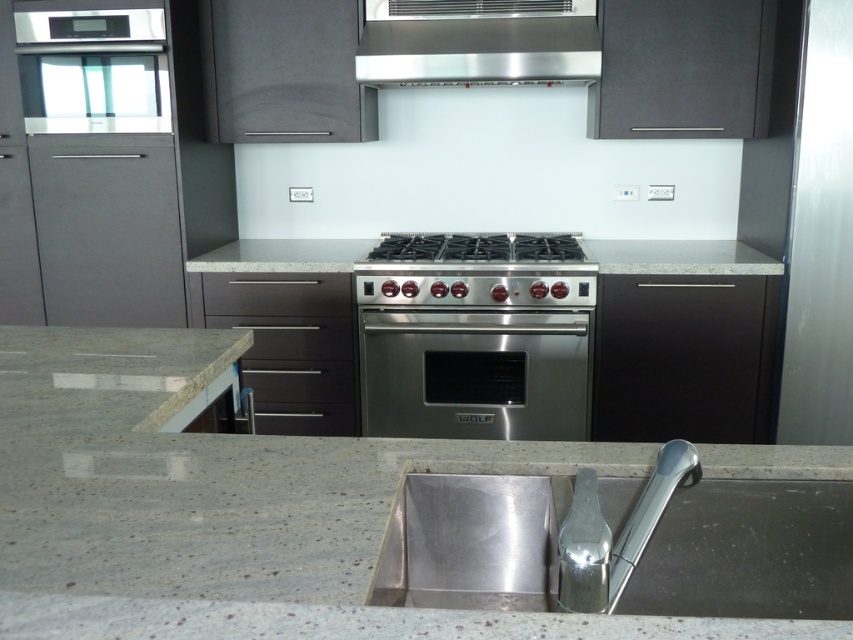
Question: Which of the following is the farthest from the observer?

Choices:
 (A) (405, 394)
 (B) (540, 588)
 (C) (21, 563)
 (D) (645, 492)

Answer: (A)

Question: Among these points, which one is nearest to the camera?

Choices:
 (A) (427, 240)
 (B) (730, 580)
 (C) (468, 374)

Answer: (B)

Question: Which is farther from the stainless steel gas stove at center?

Choices:
 (A) satin nickel faucet at lower center
 (B) stainless steel exhaust hood at upper center
 (C) stainless steel oven at center

Answer: (A)

Question: Does stainless steel sink at center appear on the left side of stainless steel gas stove at center?

Choices:
 (A) yes
 (B) no

Answer: (B)

Question: Can you confirm if stainless steel exhaust hood at upper center is thinner than satin nickel faucet at lower center?

Choices:
 (A) yes
 (B) no

Answer: (B)

Question: From the image, what is the correct spatial relationship of granite countertop at center in relation to stainless steel gas stove at center?

Choices:
 (A) right
 (B) left

Answer: (B)